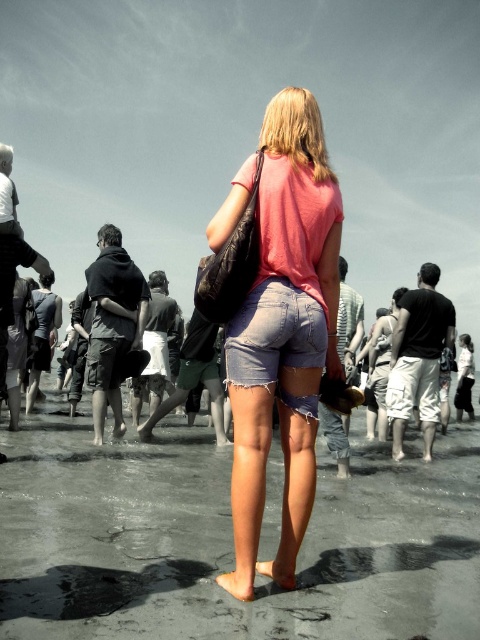
You are a photographer trying to capture the person in the pink denim shorts at center without including the ripped denim shorts at center in the frame. Based on their positions, is this possible?

The pink denim shorts at center is behind the ripped denim shorts at center, so it might be difficult to capture the pink denim shorts at center without including the ripped denim shorts at center in the frame since they are overlapping.